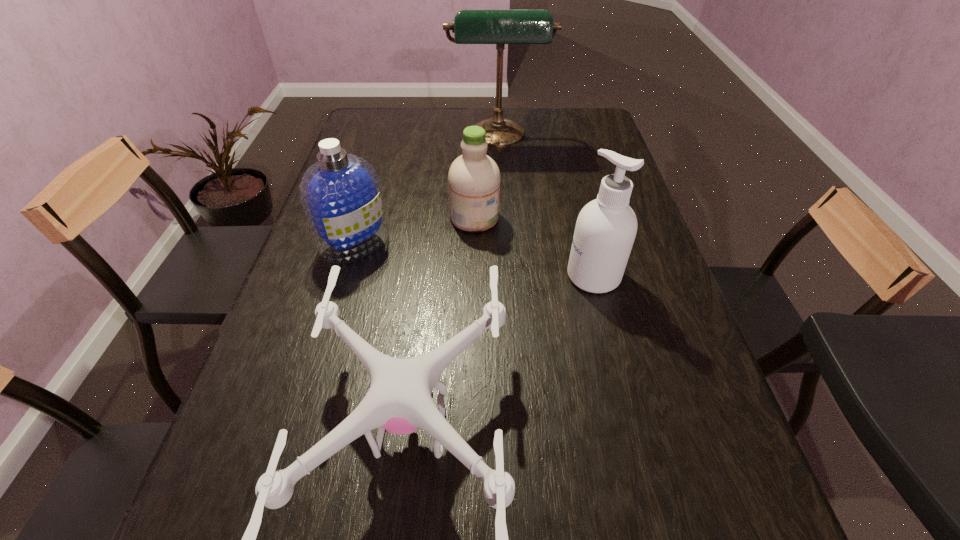
This screenshot has width=960, height=540. I want to click on the farthest object, so click(x=500, y=27).

The image size is (960, 540). Identify the location of table lamp. (500, 27).

The height and width of the screenshot is (540, 960). Find the location of `the rightmost cleansing agent`. the rightmost cleansing agent is located at coordinates (606, 227).

The height and width of the screenshot is (540, 960). I want to click on the leftmost cleansing agent, so click(x=341, y=196).

In order to click on the second cleansing agent from left to right in this screenshot , I will do `click(474, 178)`.

What are the coordinates of `vacant position located above the green lampshade of the tallest object` in the screenshot? It's located at (500, 170).

You are a GUI agent. You are given a task and a screenshot of the screen. Output one action in this format:
    pyautogui.click(x=<x>, y=<y>)
    Task: Click on the vacant region located 0.260m on the front label of the rightmost cleansing agent
    This screenshot has width=960, height=540.
    Given the screenshot: What is the action you would take?
    tap(461, 276)

Locate an element on the screen. This screenshot has width=960, height=540. free location located 0.140m on the front label of the rightmost cleansing agent is located at coordinates (510, 276).

At what (x,y) coordinates should I click in order to perform the action: click on free region located on the front label of the rightmost cleansing agent. Please return your answer as a coordinate pair (x, y). Looking at the image, I should click on (448, 276).

I want to click on vacant space located 0.310m on the back of the leftmost cleansing agent, so click(x=379, y=162).